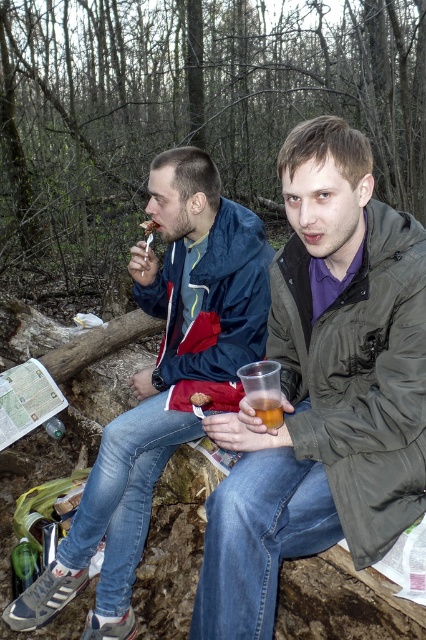
Can you confirm if translucent plastic cup at lower center is positioned above matte brown bread at center?

Yes.

Does translucent plastic cup at lower center have a smaller size compared to matte brown bread at center?

No.

This screenshot has height=640, width=426. Identify the location of translucent plastic cup at lower center. (264, 390).

Which is behind, point (301, 170) or point (157, 224)?

The point (157, 224) is more distant.

Between green matte jacket at center and matte plastic spoon at upper left, which one is positioned lower?

green matte jacket at center

The height and width of the screenshot is (640, 426). Describe the element at coordinates (324, 388) in the screenshot. I see `green matte jacket at center` at that location.

What are the coordinates of `green matte jacket at center` in the screenshot? It's located at [x=324, y=388].

Where is `matte brown bread at center`? Image resolution: width=426 pixels, height=640 pixels. matte brown bread at center is located at coordinates (199, 400).

Describe the element at coordinates (199, 400) in the screenshot. This screenshot has height=640, width=426. I see `matte brown bread at center` at that location.

I want to click on matte brown bread at center, so click(x=199, y=400).

Identify the location of matte brown bread at center. The height and width of the screenshot is (640, 426). (199, 400).